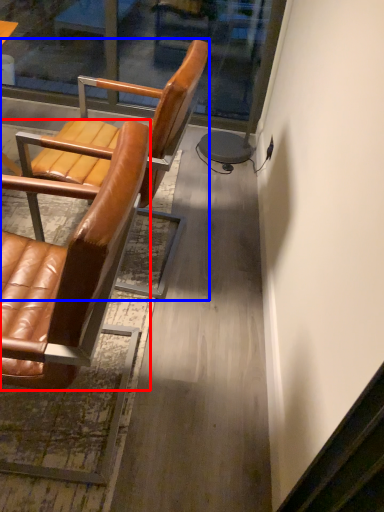
Question: Which object appears closest to the camera in this image, chair (highlighted by a red box) or chair (highlighted by a blue box)?

Choices:
 (A) chair
 (B) chair

Answer: (A)